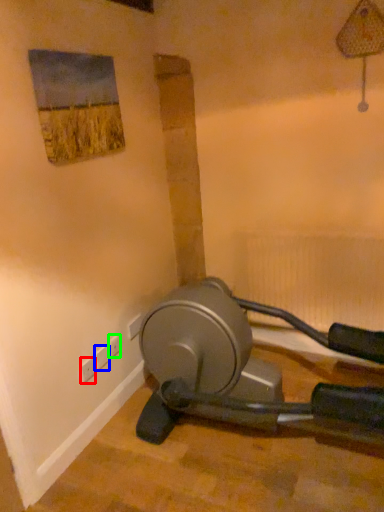
Question: Considering the real-world distances, which object is closest to electric outlet (highlighted by a red box)? plug (highlighted by a blue box) or electric outlet (highlighted by a green box).

Choices:
 (A) plug
 (B) electric outlet

Answer: (A)